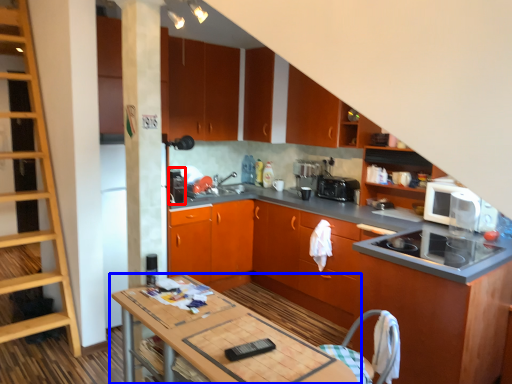
Question: Which point is closer to the camera, appliance (highlighted by a red box) or table (highlighted by a blue box)?

Choices:
 (A) appliance
 (B) table

Answer: (B)